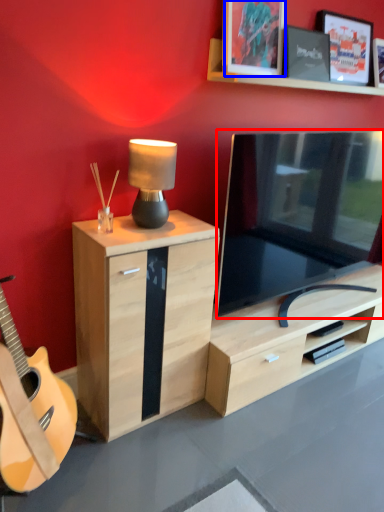
Question: Which of the following is the closest to the observer, television (highlighted by a red box) or picture frame (highlighted by a blue box)?

Choices:
 (A) television
 (B) picture frame

Answer: (A)